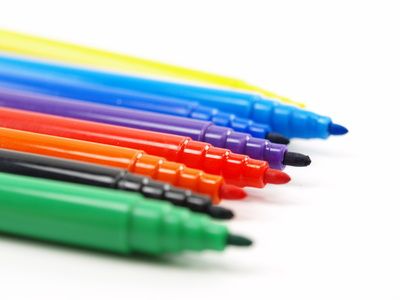
Locate an element on the screen. The height and width of the screenshot is (300, 400). markers is located at coordinates (135, 64), (142, 84), (127, 97), (113, 114), (106, 130), (97, 151), (91, 171), (89, 206).